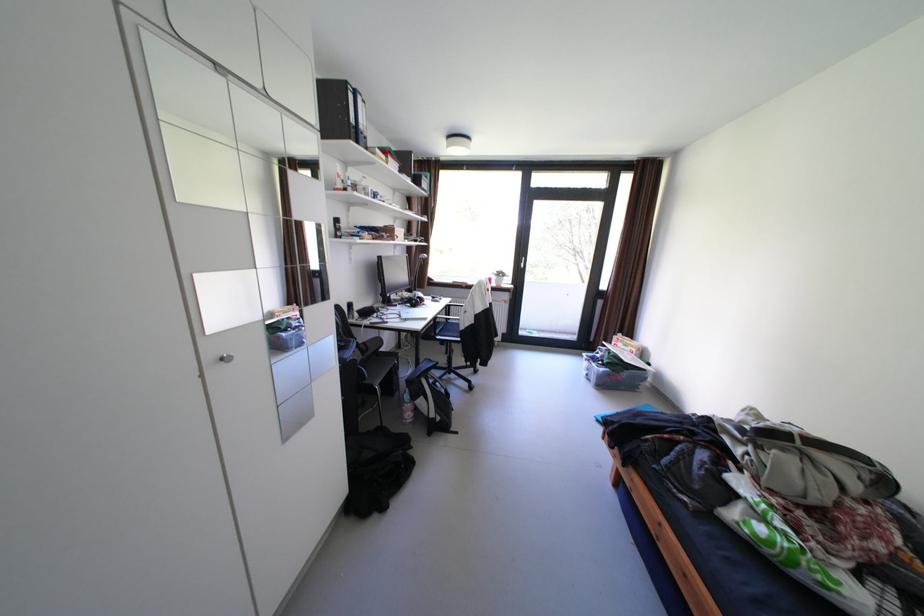
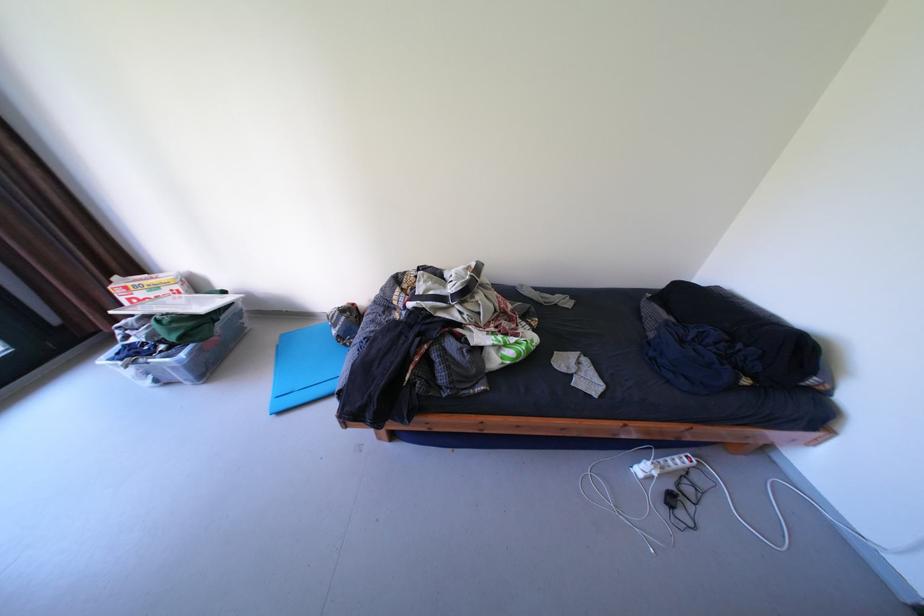
Find the pixel in the second image that matches point (645, 350) in the first image.

(188, 286)